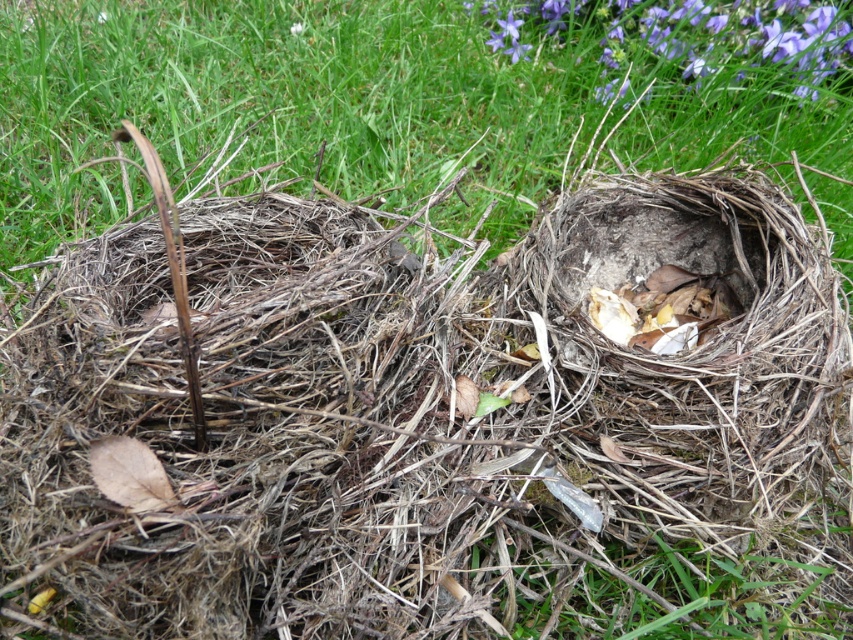
You are a gardener trying to plant a new flower in the garden. You have a small flower pot that can only accommodate plants up to the width of the purple matte flower at upper right. Based on the scene, will the green dry grass at center fit into the pot?

The green dry grass at center might be wider than the purple matte flower at upper right, so it may not fit into the pot designed for the smaller width of the purple matte flower at upper right.

You are a gardener who wants to plant a new flower in the space between the green dry grass at center and the purple matte flower at upper right. Based on their sizes, which object should you move first to make room?

The green dry grass at center is bigger than the purple matte flower at upper right, so you should move the green dry grass at center first to make more space.